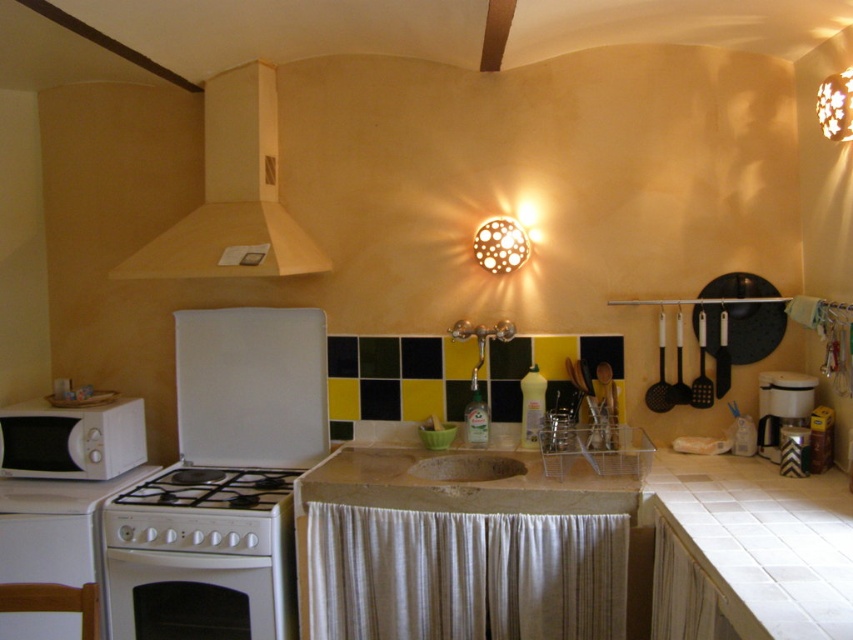
Question: Does matte white exhaust hood at upper center appear under white glossy gas stove at lower left?

Choices:
 (A) no
 (B) yes

Answer: (A)

Question: Can you confirm if white tile countertop at lower right is thinner than white matte microwave at left?

Choices:
 (A) yes
 (B) no

Answer: (B)

Question: Which of the following is the farthest from the observer?

Choices:
 (A) white glossy gas stove at lower left
 (B) white tile countertop at lower right
 (C) white matte microwave at left

Answer: (C)

Question: Does white glossy oven at lower left appear on the right side of brown stone sink at center?

Choices:
 (A) no
 (B) yes

Answer: (A)

Question: Which point is farther to the camera?

Choices:
 (A) (804, 397)
 (B) (24, 419)

Answer: (B)

Question: Which object is the closest to the white matte microwave at left?

Choices:
 (A) white glossy gas stove at lower left
 (B) matte white exhaust hood at upper center
 (C) white tile countertop at lower right

Answer: (A)